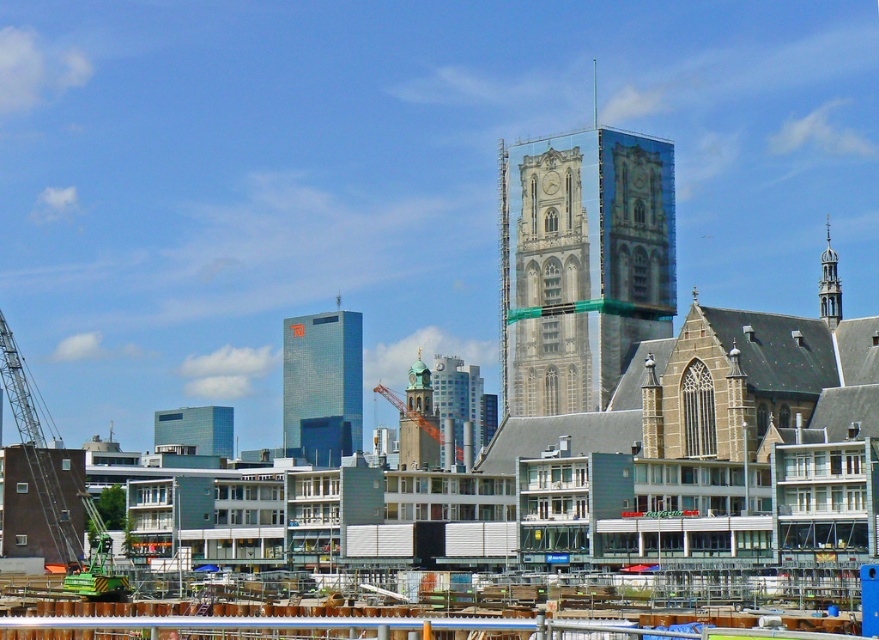
Which is below, green metallic crane at left or orange metallic crane at center?

orange metallic crane at center

Does green metallic crane at left appear on the right side of orange metallic crane at center?

In fact, green metallic crane at left is to the left of orange metallic crane at center.

You are a GUI agent. You are given a task and a screenshot of the screen. Output one action in this format:
    pyautogui.click(x=<x>, y=<y>)
    Task: Click on the green metallic crane at left
    
    Given the screenshot: What is the action you would take?
    pyautogui.click(x=35, y=448)

Locate an element on the screen. The height and width of the screenshot is (640, 879). metallic glass tower at center is located at coordinates (322, 385).

Which is more to the left, metallic glass tower at center or orange metallic crane at center?

Positioned to the left is metallic glass tower at center.

Is point (329, 420) farther from viewer compared to point (419, 413)?

That is True.

Find the location of a particular element. Image resolution: width=879 pixels, height=640 pixels. metallic glass tower at center is located at coordinates (322, 385).

Who is more distant from viewer, (741,625) or (425,429)?

The point (425,429) is more distant.

I want to click on metal scaffolding at center, so click(x=284, y=620).

At what (x,y) coordinates should I click in order to perform the action: click on metal scaffolding at center. Please return your answer as a coordinate pair (x, y). Looking at the image, I should click on (284, 620).